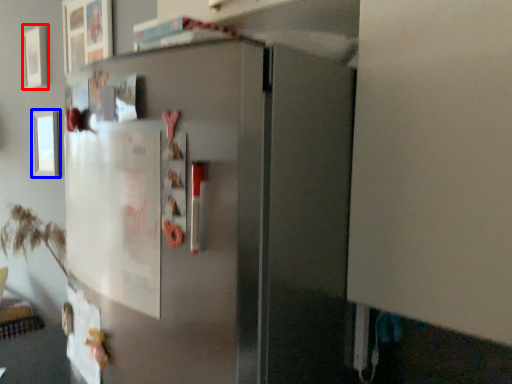
Question: Among these objects, which one is farthest to the camera, picture frame (highlighted by a red box) or picture frame (highlighted by a blue box)?

Choices:
 (A) picture frame
 (B) picture frame

Answer: (A)